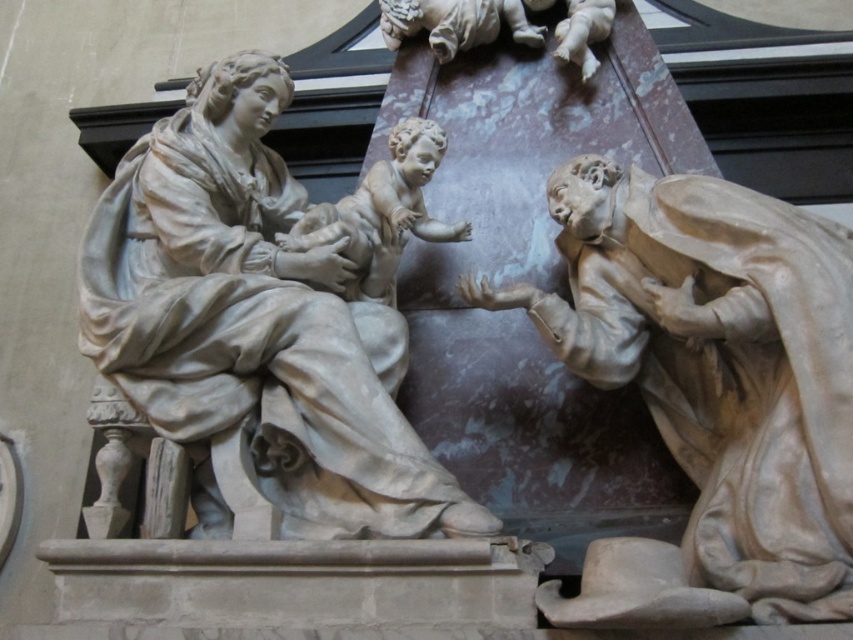
Question: Is white marble statue at upper left positioned at the back of smooth beige baby at upper center?

Choices:
 (A) yes
 (B) no

Answer: (B)

Question: Is white marble statue at upper left positioned at the back of matte stone baby at center?

Choices:
 (A) yes
 (B) no

Answer: (B)

Question: Can you confirm if white marble statue at upper left is smaller than matte stone baby at center?

Choices:
 (A) no
 (B) yes

Answer: (A)

Question: Estimate the real-world distances between objects in this image. Which object is farther from the white marble statue at upper left?

Choices:
 (A) smooth beige baby at upper center
 (B) matte beige statue at right
 (C) matte stone baby at center

Answer: (A)

Question: Which object is the farthest from the matte beige statue at right?

Choices:
 (A) smooth beige baby at upper center
 (B) white marble statue at upper left
 (C) matte stone baby at center

Answer: (A)

Question: Which point is farther from the camera taking this photo?

Choices:
 (A) (379, 218)
 (B) (467, 40)
 (C) (711, 620)
 (D) (201, 317)

Answer: (B)